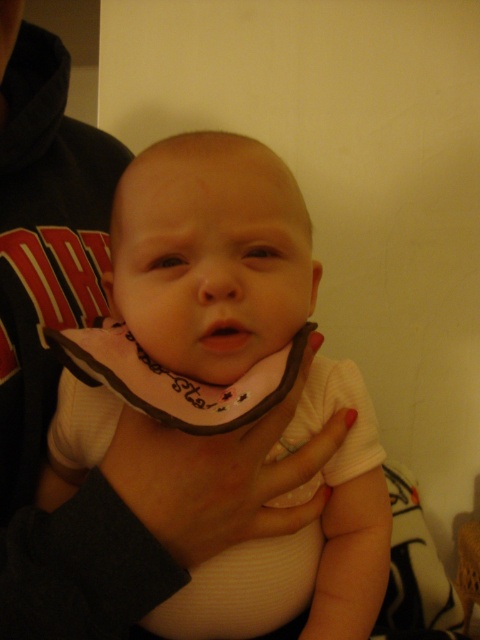
Is point (250, 412) less distant than point (230, 337)?

Yes, point (250, 412) is closer to viewer.

What do you see at coordinates (175, 378) in the screenshot? I see `white fabric neckband at center` at bounding box center [175, 378].

The height and width of the screenshot is (640, 480). I want to click on white fabric neckband at center, so click(x=175, y=378).

Is white ribbed fabric baby at center positioned in front of white fabric neckband at center?

No, white ribbed fabric baby at center is behind white fabric neckband at center.

The image size is (480, 640). Find the location of `white ribbed fabric baby at center`. white ribbed fabric baby at center is located at coordinates (210, 252).

I want to click on white ribbed fabric baby at center, so click(210, 252).

From the picture: Is white ribbed fabric baby at center to the right of matte pink lips at center from the viewer's perspective?

In fact, white ribbed fabric baby at center is to the left of matte pink lips at center.

How distant is white ribbed fabric baby at center from matte pink lips at center?

white ribbed fabric baby at center is 13.63 centimeters from matte pink lips at center.

Measure the distance between point (x=304, y=636) and camera.

A distance of 19.34 inches exists between point (x=304, y=636) and camera.

In order to click on white ribbed fabric baby at center in this screenshot , I will do `click(210, 252)`.